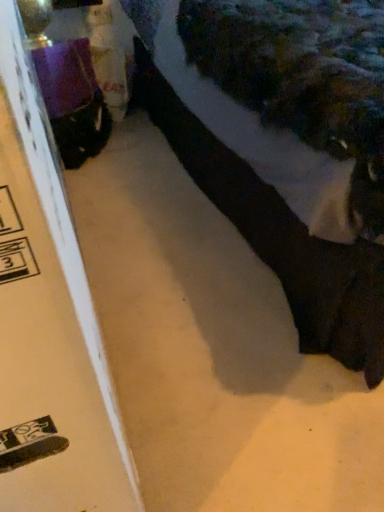
The height and width of the screenshot is (512, 384). What are the coordinates of `white cardboard box at left` in the screenshot? It's located at (48, 324).

Image resolution: width=384 pixels, height=512 pixels. Describe the element at coordinates (48, 324) in the screenshot. I see `white cardboard box at left` at that location.

Find the location of a particular element. white cardboard box at left is located at coordinates (48, 324).